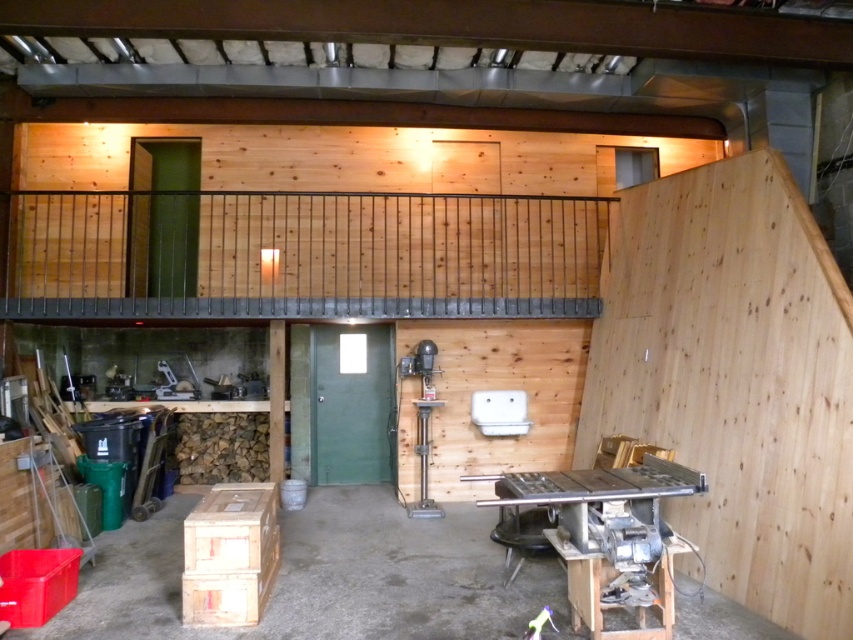
Which is below, wooden crate at lower left or metallic gray table at lower right?

wooden crate at lower left

Between wooden crate at lower left and metallic gray table at lower right, which one appears on the right side from the viewer's perspective?

metallic gray table at lower right

Where is `wooden crate at lower left`? The width and height of the screenshot is (853, 640). wooden crate at lower left is located at coordinates (323, 579).